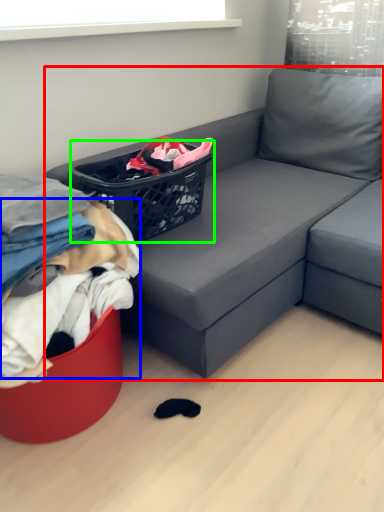
Question: Which object is positioned closest to studio couch (highlighted by a red box)? Select from clothing (highlighted by a blue box) and basket (highlighted by a green box).

Choices:
 (A) clothing
 (B) basket

Answer: (B)